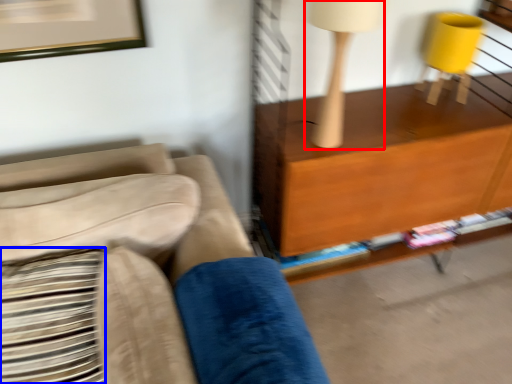
Question: Which object appears farthest to the camera in this image, table lamp (highlighted by a red box) or pillow (highlighted by a blue box)?

Choices:
 (A) table lamp
 (B) pillow

Answer: (A)